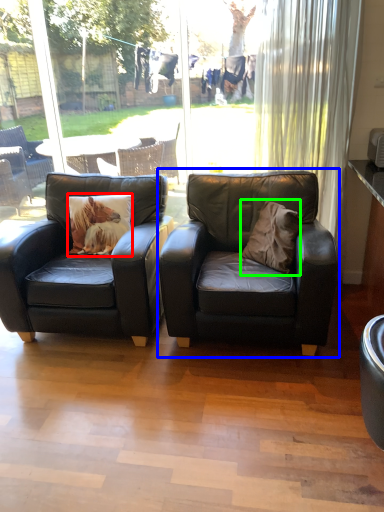
Question: Which object is positioned closest to pillow (highlighted by a red box)? Select from chair (highlighted by a blue box) and throw pillow (highlighted by a green box).

Choices:
 (A) chair
 (B) throw pillow

Answer: (A)